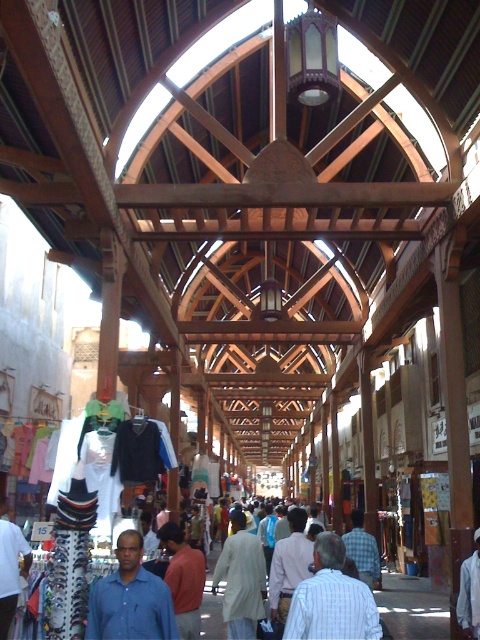
You are a customer in the market looking at the red shirt at center and the white fabric shirt at center. Which shirt can you see more of from your current position?

The red shirt at center is in front of the white fabric shirt at center, so you can see more of the red shirt at center.

Based on the photo, you are standing in the market and want to buy the blue shirt at center. Which direction should you walk to reach it from your current position?

The blue shirt at center is located at point (x=130, y=598), so you should walk towards the center of the market to reach it.

You are a customer in the market and want to buy a shirt. You see the red shirt at center and the white fabric shirt at center. Which one is shorter in height?

The red shirt at center is not as tall as the white fabric shirt at center, so the red shirt at center is shorter in height.